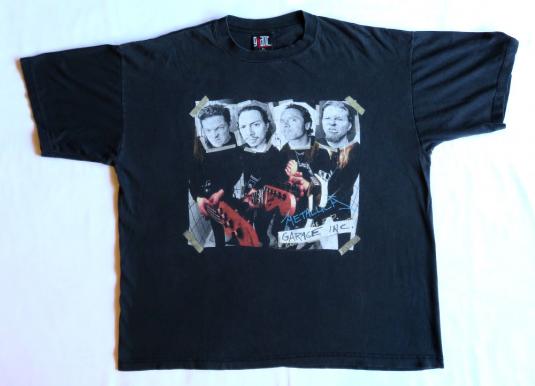
This screenshot has width=535, height=386. What are the coordinates of `screen art` in the screenshot? It's located at (325, 206).